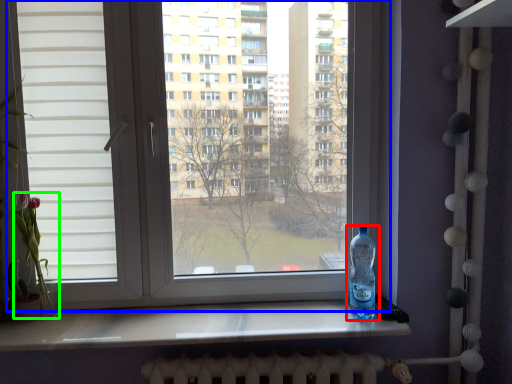
Question: Estimate the real-world distances between objects in this image. Which object is farther from bottle (highlighted by a red box), window (highlighted by a blue box) or flower (highlighted by a green box)?

Choices:
 (A) window
 (B) flower

Answer: (B)